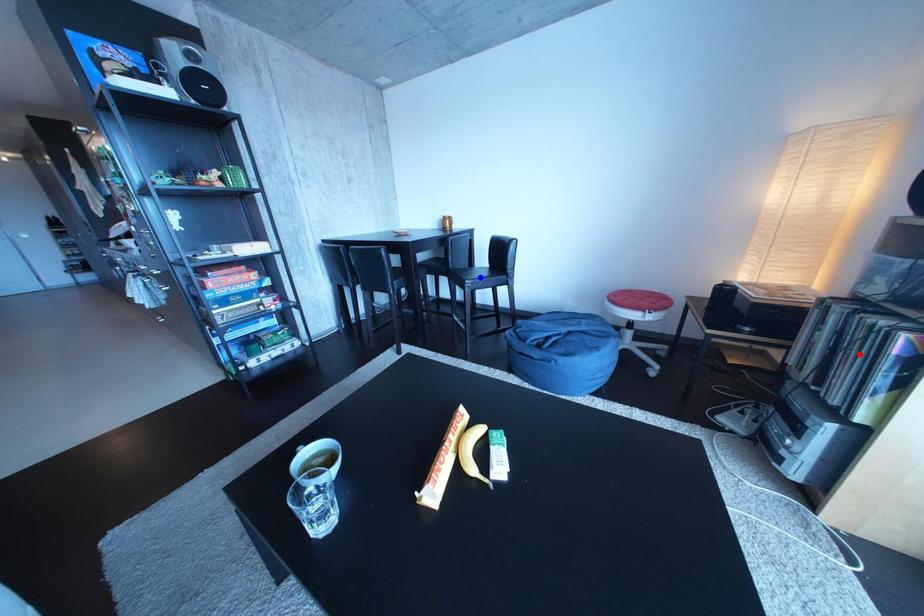
Question: Two points are marked on the image. Which point is closer to the camera?

Choices:
 (A) Blue point is closer.
 (B) Red point is closer.

Answer: (B)